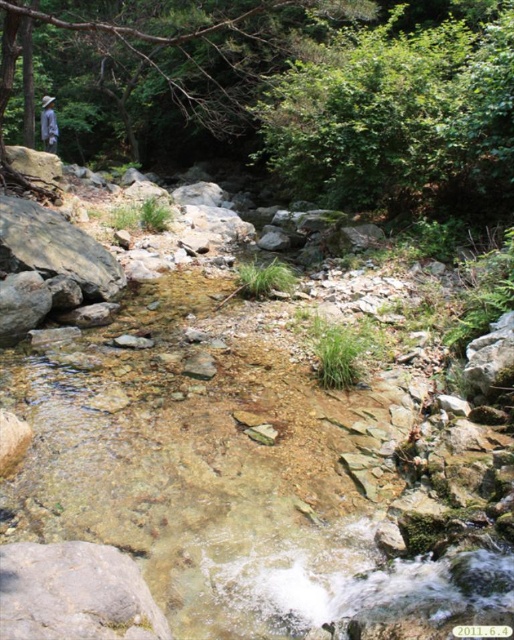
You are hiking and come across this stream. You want to cross the stream using the clear rock water at center and the blue fabric shirt at upper left. Which object is positioned lower in the scene?

The clear rock water at center is positioned below the blue fabric shirt at upper left, so the clear rock water at center is lower in the scene.